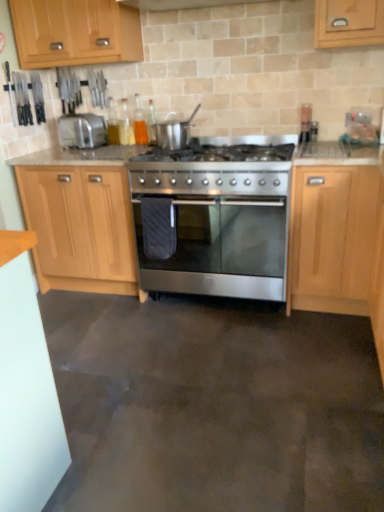
Question: Is satin silver pot at center beside light wood/finish cabinet at upper left, arranged as the third cabinetry when viewed from the right?

Choices:
 (A) yes
 (B) no

Answer: (B)

Question: Is satin silver pot at center shorter than light wood/finish cabinet at upper left, which is the first cabinetry in left-to-right order?

Choices:
 (A) no
 (B) yes

Answer: (B)

Question: Is light wood/finish cabinet at upper left, which is the first cabinetry in left-to-right order, at the back of satin silver pot at center?

Choices:
 (A) no
 (B) yes

Answer: (A)

Question: From a real-world perspective, is satin silver pot at center located beneath light wood/finish cabinet at upper left, which is the first cabinetry in left-to-right order?

Choices:
 (A) no
 (B) yes

Answer: (B)

Question: Can light wood/finish cabinet at upper left, which is the first cabinetry in left-to-right order, be found inside satin silver pot at center?

Choices:
 (A) yes
 (B) no

Answer: (B)

Question: Is light wood/texture cabinet at left, acting as the 2th cabinetry starting from the left, inside the boundaries of stainless steel oven at center, or outside?

Choices:
 (A) inside
 (B) outside

Answer: (B)

Question: From the image's perspective, is light wood/texture cabinet at left, acting as the 2th cabinetry starting from the left, located above or below stainless steel oven at center?

Choices:
 (A) below
 (B) above

Answer: (B)

Question: Is light wood/texture cabinet at left, acting as the 2th cabinetry starting from the left, taller or shorter than stainless steel oven at center?

Choices:
 (A) tall
 (B) short

Answer: (A)

Question: Is light wood/texture cabinet at left, acting as the 2th cabinetry starting from the left, to the left or to the right of stainless steel oven at center in the image?

Choices:
 (A) right
 (B) left

Answer: (B)

Question: Is stainless steel oven at center to the left or to the right of silver metallic toaster at left in the image?

Choices:
 (A) right
 (B) left

Answer: (A)

Question: From their relative heights in the image, would you say stainless steel oven at center is taller or shorter than silver metallic toaster at left?

Choices:
 (A) short
 (B) tall

Answer: (B)

Question: Considering their positions, is stainless steel oven at center located in front of or behind silver metallic toaster at left?

Choices:
 (A) front
 (B) behind

Answer: (A)

Question: From the image's perspective, is stainless steel oven at center located above or below silver metallic toaster at left?

Choices:
 (A) above
 (B) below

Answer: (B)

Question: Considering the relative positions of satin silver pot at center and stainless steel oven at center in the image provided, is satin silver pot at center to the left or to the right of stainless steel oven at center?

Choices:
 (A) right
 (B) left

Answer: (B)

Question: From their relative heights in the image, would you say satin silver pot at center is taller or shorter than stainless steel oven at center?

Choices:
 (A) tall
 (B) short

Answer: (B)